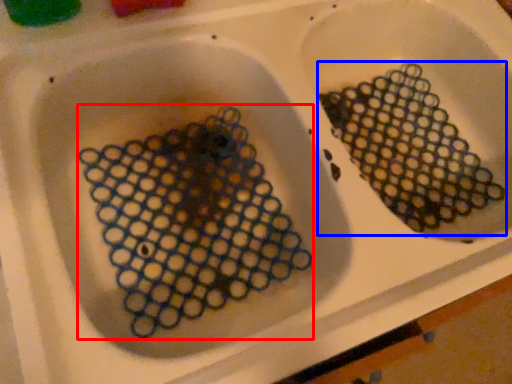
Question: Which point is closer to the camera, debris (highlighted by a red box) or debris (highlighted by a blue box)?

Choices:
 (A) debris
 (B) debris

Answer: (A)